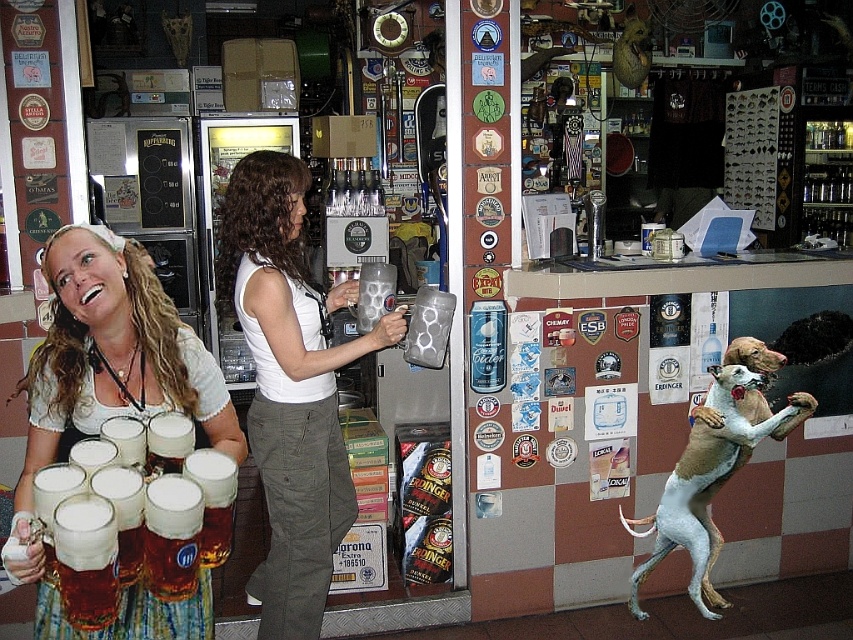
Question: Which of the following is the farthest from the observer?

Choices:
 (A) matte white blouse at center
 (B) white cotton tank top at center

Answer: (B)

Question: Can you confirm if matte white blouse at center is positioned to the right of light brown fur at lower right?

Choices:
 (A) yes
 (B) no

Answer: (B)

Question: Is white cotton tank top at center below light brown fur at lower right?

Choices:
 (A) yes
 (B) no

Answer: (B)

Question: Which of the following is the closest to the observer?

Choices:
 (A) matte white blouse at center
 (B) white cotton tank top at center

Answer: (A)

Question: Does white cotton tank top at center have a smaller size compared to matte white blouse at center?

Choices:
 (A) yes
 (B) no

Answer: (B)

Question: Which point is closer to the camera taking this photo?

Choices:
 (A) (84, 401)
 (B) (251, 209)

Answer: (A)